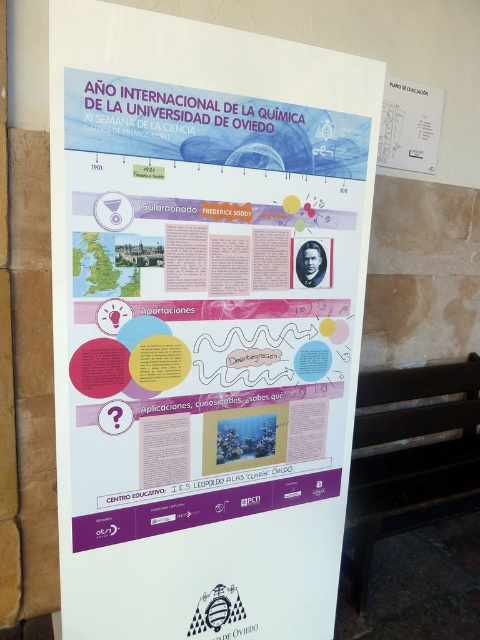
Question: Does white paper poster at center lie in front of black wood park bench at lower right?

Choices:
 (A) yes
 (B) no

Answer: (A)

Question: Among these objects, which one is nearest to the camera?

Choices:
 (A) black wood park bench at lower right
 (B) white paper poster at center

Answer: (B)

Question: In this image, where is white paper poster at center located relative to black wood park bench at lower right?

Choices:
 (A) above
 (B) below

Answer: (A)

Question: Does white paper poster at center appear on the left side of black wood park bench at lower right?

Choices:
 (A) no
 (B) yes

Answer: (B)

Question: Which of the following is the closest to the observer?

Choices:
 (A) black wood park bench at lower right
 (B) white paper poster at center

Answer: (B)